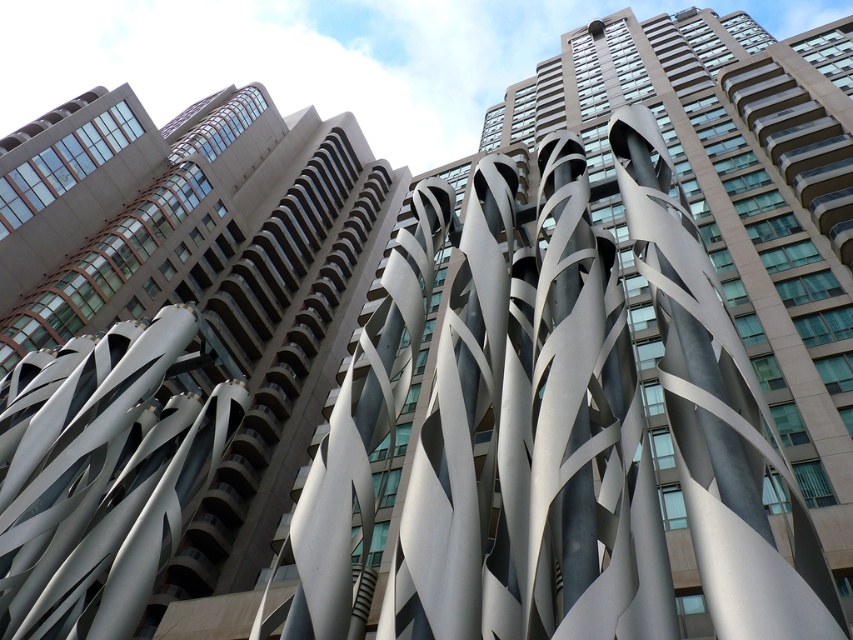
Question: Can you confirm if metallic silver sculpture at center is wider than satin silver sculpture at center?

Choices:
 (A) no
 (B) yes

Answer: (B)

Question: Among these points, which one is nearest to the camera?

Choices:
 (A) (199, 288)
 (B) (152, 484)

Answer: (B)

Question: Which point is closer to the camera?

Choices:
 (A) (117, 516)
 (B) (140, 541)

Answer: (B)

Question: Can you confirm if metallic silver sculpture at center is positioned to the right of satin silver sculpture at center?

Choices:
 (A) no
 (B) yes

Answer: (A)

Question: Observing the image, what is the correct spatial positioning of metallic silver sculpture at center in reference to satin silver sculpture at center?

Choices:
 (A) above
 (B) below

Answer: (A)